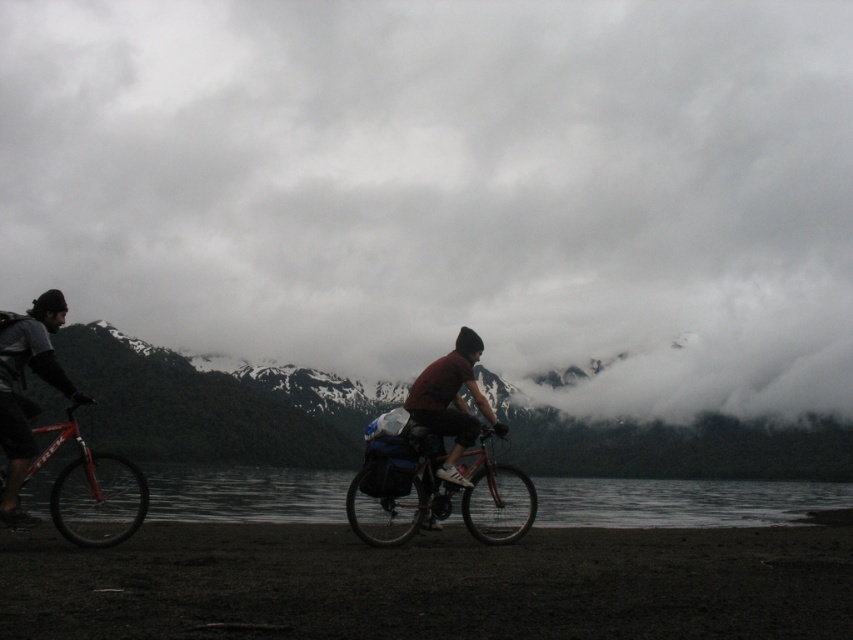
What do you see at coordinates (398, 486) in the screenshot? I see `shiny metallic bicycle at center` at bounding box center [398, 486].

Locate an element on the screen. The height and width of the screenshot is (640, 853). shiny metallic bicycle at center is located at coordinates (398, 486).

Identify the location of shiny metallic bicycle at center. (398, 486).

Between point (682, 490) and point (120, 470), which one is positioned in front?

Point (120, 470)

What do you see at coordinates (682, 500) in the screenshot? I see `transparent water at lower center` at bounding box center [682, 500].

You are a GUI agent. You are given a task and a screenshot of the screen. Output one action in this format:
    pyautogui.click(x=<x>, y=<y>)
    Task: Click on the transparent water at lower center
    Image resolution: width=853 pixels, height=640 pixels.
    Given the screenshot: What is the action you would take?
    pyautogui.click(x=682, y=500)

Does transparent water at lower center have a larger size compared to matte black jacket at left?

Indeed, transparent water at lower center has a larger size compared to matte black jacket at left.

From the picture: Which is more to the left, transparent water at lower center or matte black jacket at left?

From the viewer's perspective, matte black jacket at left appears more on the left side.

Is point (619, 493) farther from viewer compared to point (33, 337)?

Yes, it is behind point (33, 337).

At what (x,y) coordinates should I click in order to perform the action: click on transparent water at lower center. Please return your answer as a coordinate pair (x, y). Looking at the image, I should click on (682, 500).